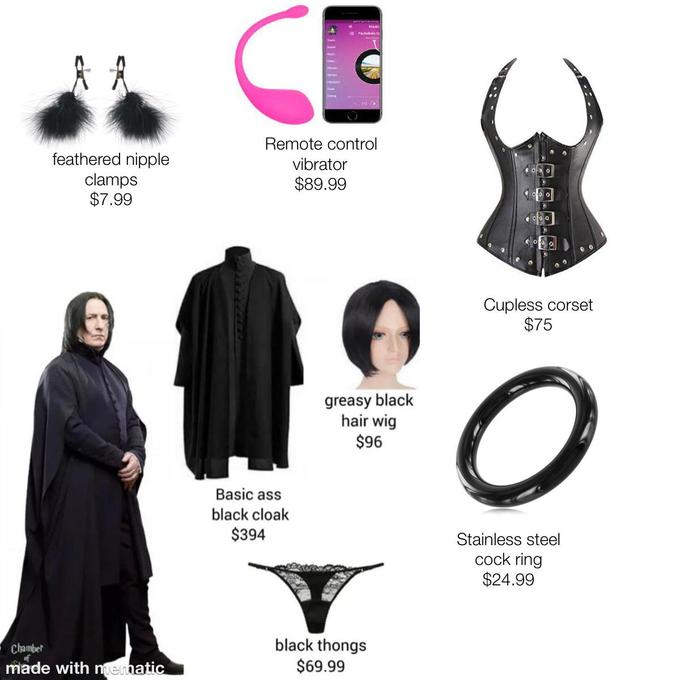
Identify the location of photo of mobile phone. (343, 65).